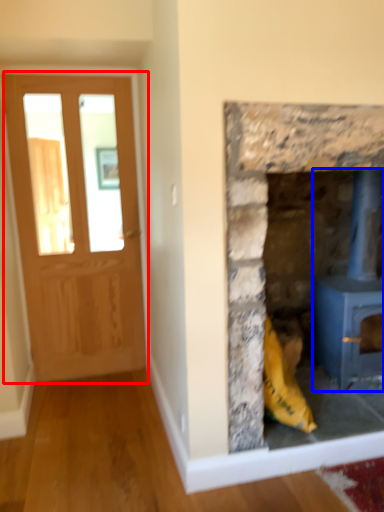
Question: Which object appears closest to the camera in this image, glass door (highlighted by a red box) or wood burning stove (highlighted by a blue box)?

Choices:
 (A) glass door
 (B) wood burning stove

Answer: (B)